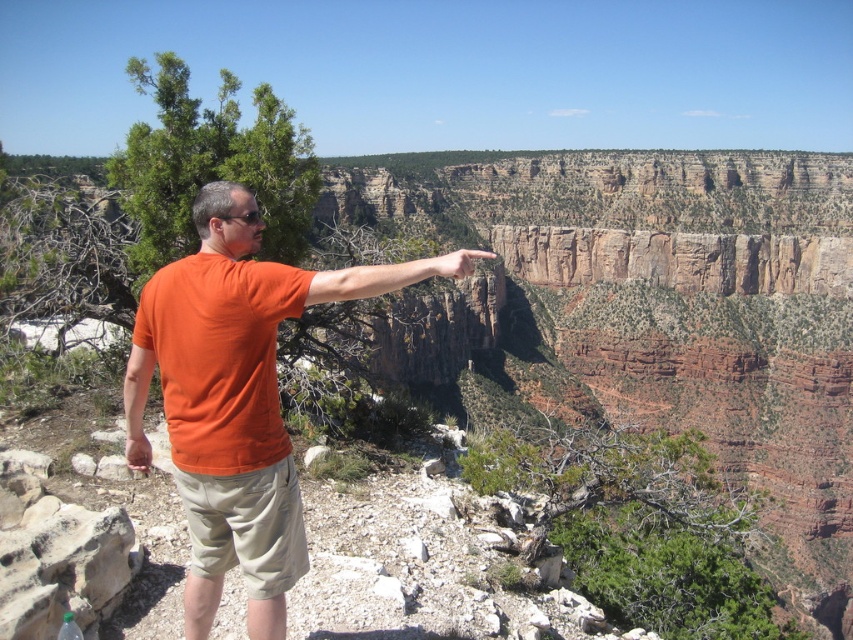
Question: Which of the following is the farthest from the observer?

Choices:
 (A) matte skin hand at upper center
 (B) orange cotton shirt at center

Answer: (A)

Question: Can you confirm if orange cotton shirt at center is wider than matte skin hand at upper center?

Choices:
 (A) yes
 (B) no

Answer: (A)

Question: Which point appears farthest from the camera in this image?

Choices:
 (A) (213, 301)
 (B) (427, 268)

Answer: (B)

Question: Does orange cotton shirt at center have a greater width compared to matte skin hand at upper center?

Choices:
 (A) no
 (B) yes

Answer: (B)

Question: Is orange cotton shirt at center bigger than matte skin hand at upper center?

Choices:
 (A) yes
 (B) no

Answer: (B)